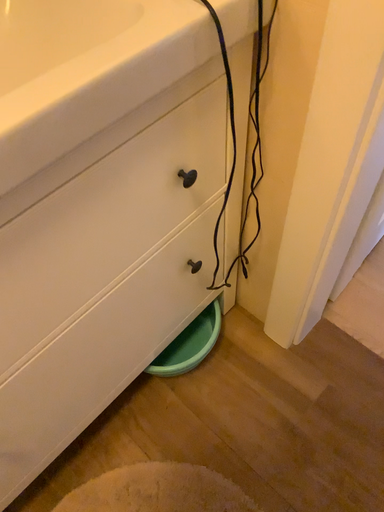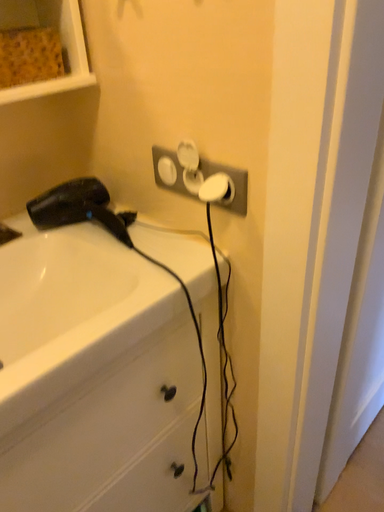
Question: Which way did the camera rotate in the video?

Choices:
 (A) rotated downward
 (B) rotated upward

Answer: (B)